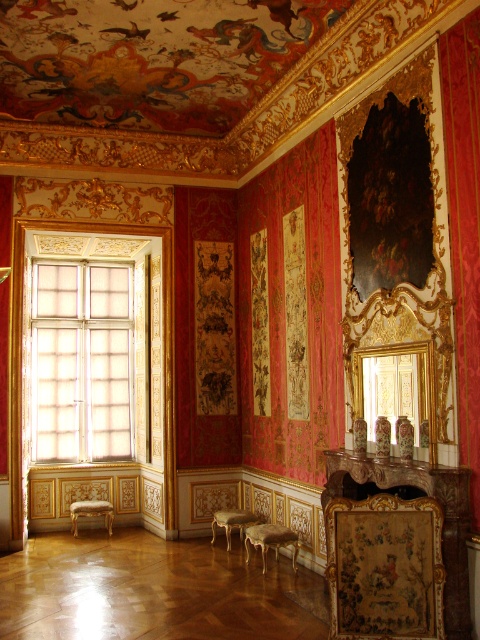
Looking at this image, can you confirm if gold upholstered stool at lower center is bigger than gold upholstered stool at lower left?

No.

The height and width of the screenshot is (640, 480). Identify the location of gold upholstered stool at lower center. (269, 540).

The height and width of the screenshot is (640, 480). In order to click on gold upholstered stool at lower center in this screenshot , I will do `click(269, 540)`.

Locate an element on the screen. This screenshot has width=480, height=640. translucent glass window at left is located at coordinates click(82, 362).

The width and height of the screenshot is (480, 640). What do you see at coordinates (82, 362) in the screenshot?
I see `translucent glass window at left` at bounding box center [82, 362].

Does translucent glass window at left have a lesser width compared to gold upholstered stool at lower left?

No, translucent glass window at left is not thinner than gold upholstered stool at lower left.

Image resolution: width=480 pixels, height=640 pixels. I want to click on translucent glass window at left, so click(82, 362).

Where is `translucent glass window at left`? Image resolution: width=480 pixels, height=640 pixels. translucent glass window at left is located at coordinates click(82, 362).